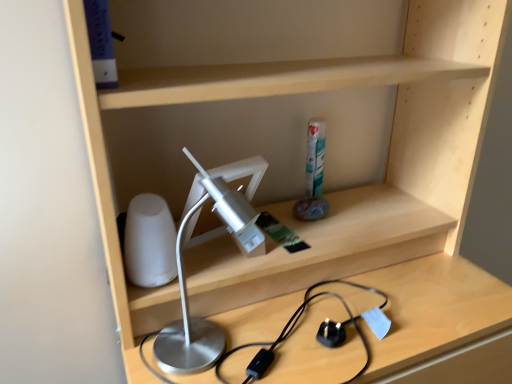
Where is `silver metallic desk lamp at left`? The height and width of the screenshot is (384, 512). silver metallic desk lamp at left is located at coordinates (186, 287).

What do you see at coordinates (186, 287) in the screenshot?
I see `silver metallic desk lamp at left` at bounding box center [186, 287].

Find the location of `silver metallic desk lamp at left`. silver metallic desk lamp at left is located at coordinates (186, 287).